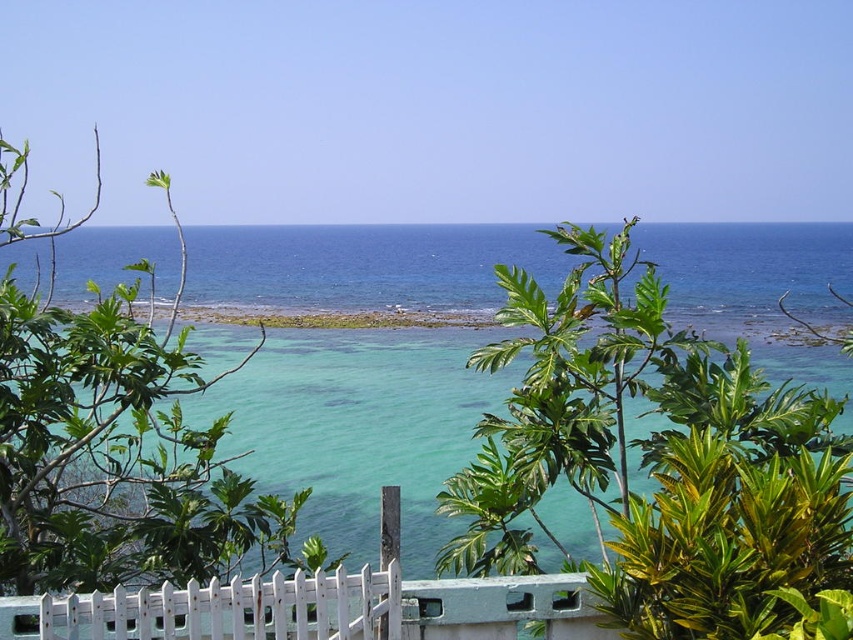
Question: Can you confirm if green leafy plant at upper left is positioned above white painted wood fence at center?

Choices:
 (A) no
 (B) yes

Answer: (B)

Question: Where is green leafy plant at upper left located in relation to clear sand at center in the image?

Choices:
 (A) right
 (B) left

Answer: (B)

Question: Is white painted wood fence at center thinner than clear sand at center?

Choices:
 (A) yes
 (B) no

Answer: (A)

Question: Which is farther from the white painted wood fence at center?

Choices:
 (A) clear blue water at center
 (B) green leafy plant at upper left
 (C) clear sand at center

Answer: (A)

Question: Which of the following is the closest to the observer?

Choices:
 (A) clear blue water at center
 (B) clear sand at center

Answer: (A)

Question: Estimate the real-world distances between objects in this image. Which object is farther from the clear sand at center?

Choices:
 (A) green leafy plant at upper left
 (B) white painted wood fence at center

Answer: (B)